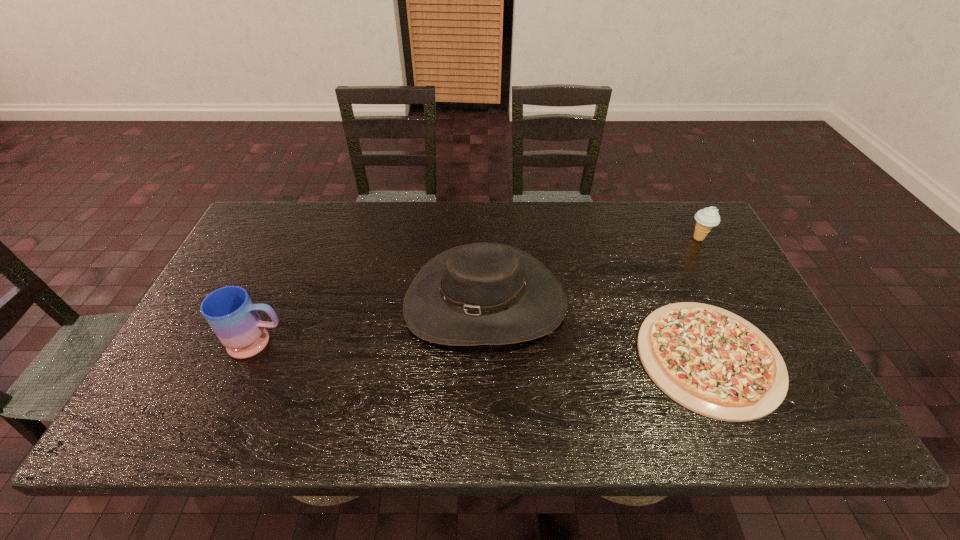
This screenshot has width=960, height=540. What are the coordinates of `free space that satisfies the following two spatial constraints: 1. on the front-facing side of the shortest object; 2. on the left side of the second object from left to right` in the screenshot? It's located at (485, 357).

Locate an element on the screen. The width and height of the screenshot is (960, 540). blank area in the image that satisfies the following two spatial constraints: 1. on the front-facing side of the second object from left to right; 2. on the side of the mug with the handle is located at coordinates (485, 342).

The height and width of the screenshot is (540, 960). I want to click on free space in the image that satisfies the following two spatial constraints: 1. on the front-facing side of the cowboy hat; 2. on the right side of the pizza, so point(485,357).

Find the location of a particular element. free space that satisfies the following two spatial constraints: 1. on the side of the mug with the handle; 2. on the back side of the pizza is located at coordinates (252, 357).

You are a GUI agent. You are given a task and a screenshot of the screen. Output one action in this format:
    pyautogui.click(x=<x>, y=<y>)
    Task: Click on the free point that satisfies the following two spatial constraints: 1. on the front-facing side of the cowboy hat; 2. on the side of the mug with the handle
    The width and height of the screenshot is (960, 540).
    Given the screenshot: What is the action you would take?
    pyautogui.click(x=485, y=342)

This screenshot has height=540, width=960. In order to click on vacant region that satisfies the following two spatial constraints: 1. on the front-facing side of the pizza; 2. on the right side of the third object from right to left in this screenshot , I will do `click(485, 357)`.

Where is `free point that satisfies the following two spatial constraints: 1. on the front-facing side of the third object from right to left; 2. on the side of the leftmost object with the handle`? This screenshot has height=540, width=960. free point that satisfies the following two spatial constraints: 1. on the front-facing side of the third object from right to left; 2. on the side of the leftmost object with the handle is located at coordinates (485, 342).